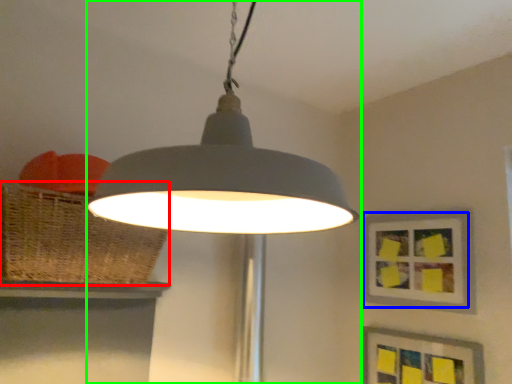
Question: Estimate the real-world distances between objects in this image. Which object is closer to basket (highlighted by a red box), picture frame (highlighted by a blue box) or lamp (highlighted by a green box)?

Choices:
 (A) picture frame
 (B) lamp

Answer: (B)